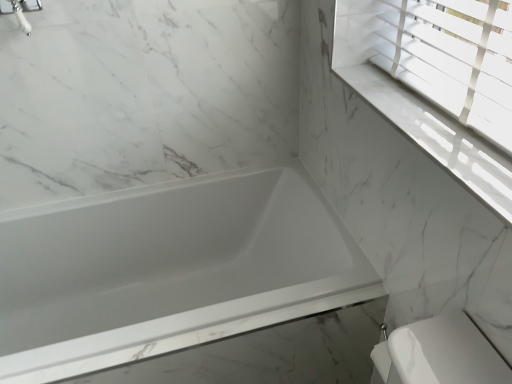
The height and width of the screenshot is (384, 512). In order to click on empty space that is ontop of white marble window sill at upper right (from a real-world perspective) in this screenshot , I will do `click(423, 124)`.